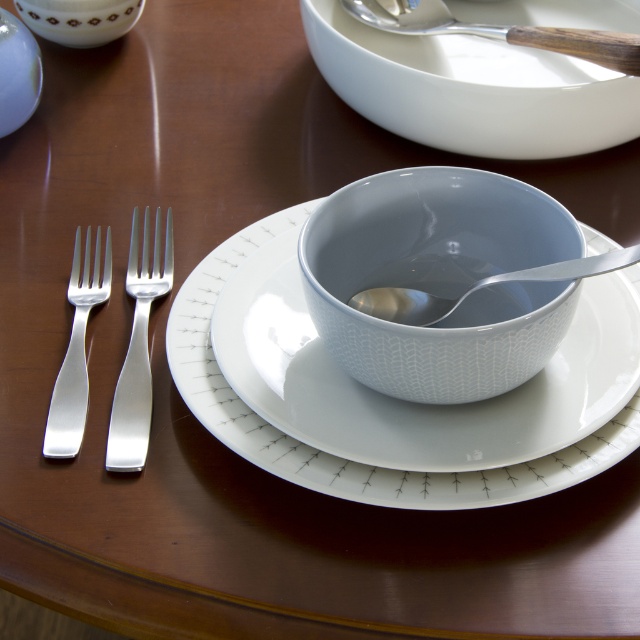
Question: Where is silver metallic fork at left located in relation to matte white bowl at upper left in the image?

Choices:
 (A) below
 (B) above

Answer: (A)

Question: Does white glossy bowl at center appear on the right side of silver metallic fork at left?

Choices:
 (A) no
 (B) yes

Answer: (B)

Question: Which object is positioned closest to the white glossy saucer at center?

Choices:
 (A) white glossy platter at upper center
 (B) matte white bowl at upper left
 (C) polished silver fork at left

Answer: (C)

Question: Among these points, which one is farthest from the camera?

Choices:
 (A) (145, 314)
 (B) (513, 312)
 (C) (68, 362)

Answer: (B)

Question: Among these objects, which one is nearest to the camera?

Choices:
 (A) silver metallic spoon at center
 (B) white glossy plate at upper left

Answer: (A)

Question: Is white glossy platter at upper center wider than polished silver fork at left?

Choices:
 (A) no
 (B) yes

Answer: (B)